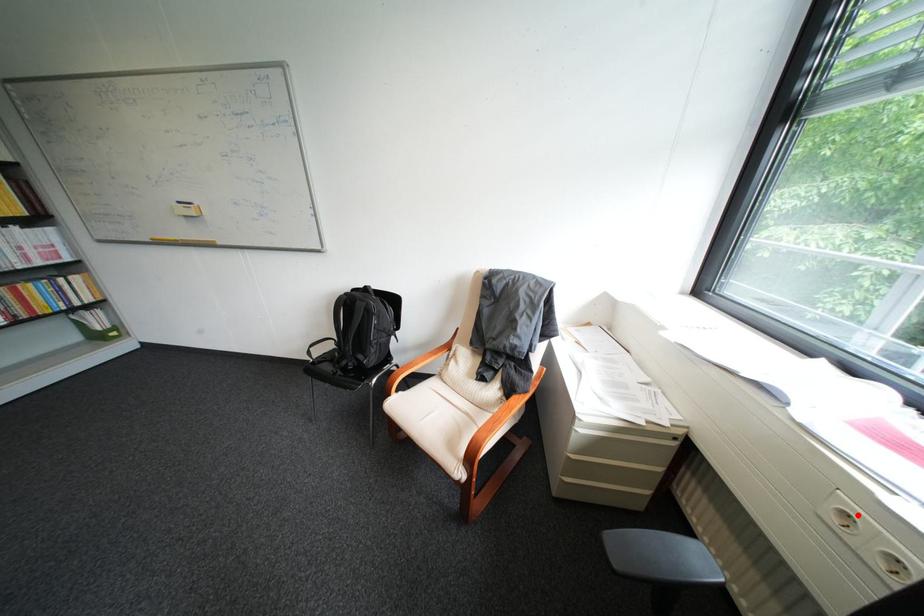
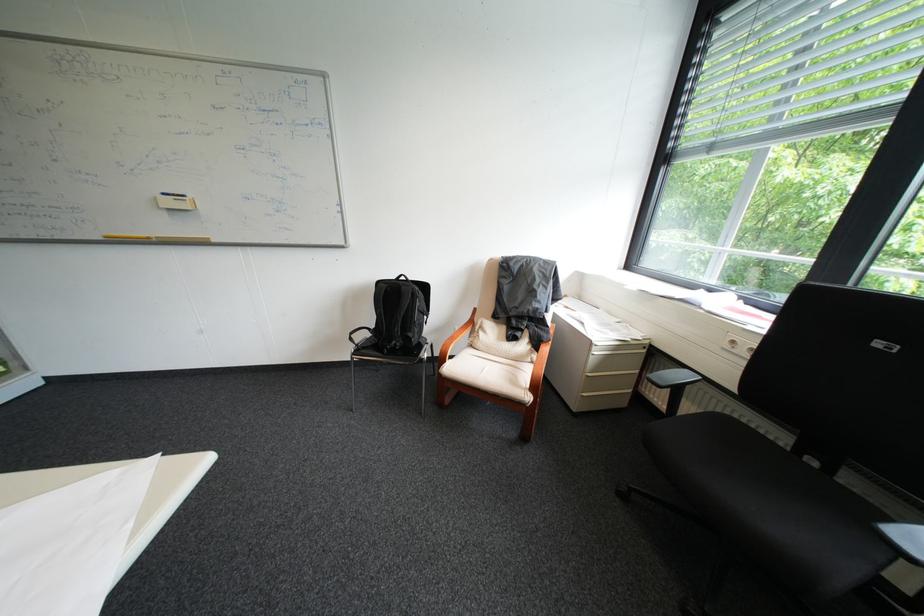
Where in the second image is the point corresponding to the highlighted location from the first image?

(746, 342)